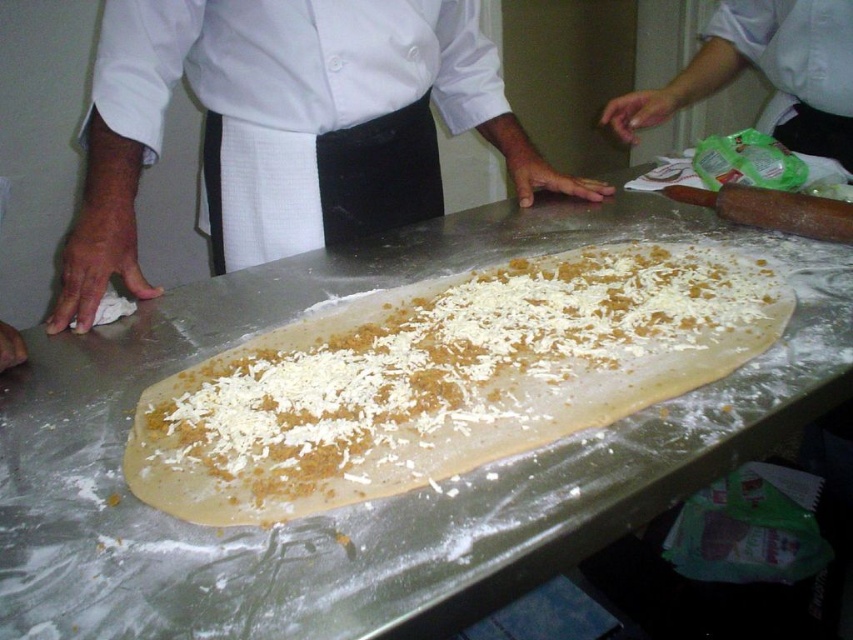
You are a chef trying to reach the white fabric apron at center while standing near the white cloth at left. Can you comfortably reach it without moving your feet?

The distance between the white cloth at left and the white fabric apron at center is 2.12 inches, so yes, you can comfortably reach the white fabric apron at center without moving your feet since it is within arm reach.

You are a chef trying to reach the white crumbly dough at center without moving your hands from their current position on the white cloth at left. Can you reach it?

The white crumbly dough at center is 15.23 inches away from the white cloth at left. Since the distance is 15.23 inches, which is approximately 1.27 feet, a chef with an average arm span of about 2 feet can likely reach the dough without moving their hands.

You are a chef standing in the kitchen and need to reach for the white crumbly dough at center while wearing the white fabric apron at center. Can you comfortably reach the dough without moving your position?

The white crumbly dough at center and white fabric apron at center are 16.25 inches apart, so yes, you can comfortably reach the dough without moving your position since the distance is within a typical comfortable reaching range.